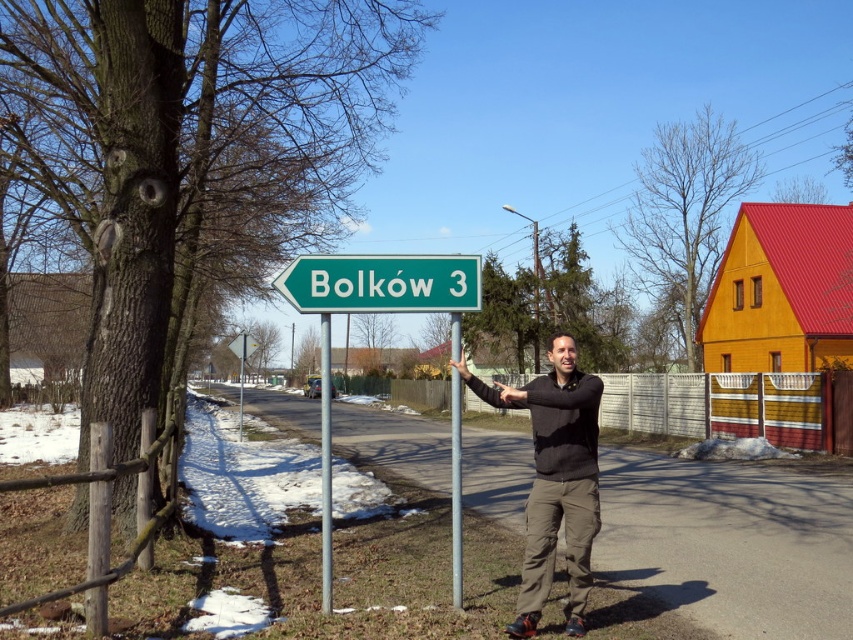
Based on the photo, you are a hiker trying to determine the direction of the road sign. You notice two metallic poles at the center of the image. Which pole is to the left when facing the green metallic pole at center?

The metallic pole at center is positioned on the left side of the green metallic pole at center, so when facing the green metallic pole at center, the metallic pole at center is to its left.

You are standing at the point with coordinates point (x=454, y=570) and want to walk towards the point (x=570, y=456). Which direction should you face to walk directly towards it?

You should face towards the direction where point (x=570, y=456) is located because it is closer to you than point (x=454, y=570), so walking towards it would require facing in that direction.